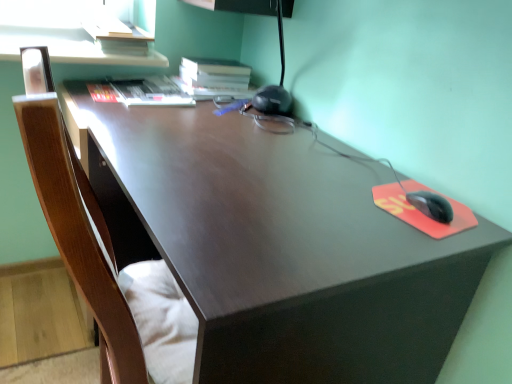
The width and height of the screenshot is (512, 384). What are the coordinates of `vacant area located to the right-hand side of hardcover book at upper left, the 2th book in the right-to-left sequence` in the screenshot? It's located at (215, 114).